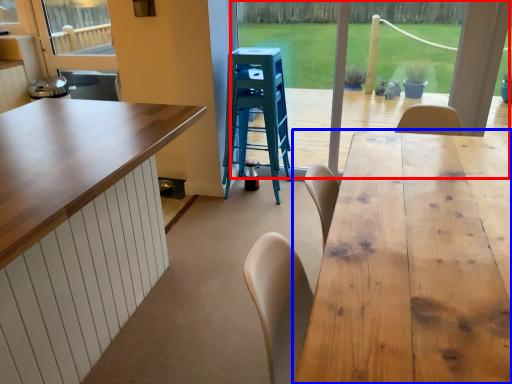
Question: Which point is closer to the camera, window frame (highlighted by a red box) or table (highlighted by a blue box)?

Choices:
 (A) window frame
 (B) table

Answer: (B)